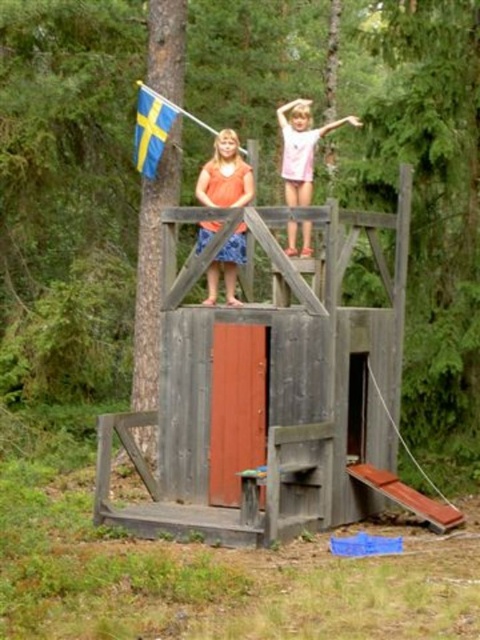
Question: Which of the following is the farthest from the observer?

Choices:
 (A) (151, 140)
 (B) (210, 237)

Answer: (A)

Question: Estimate the real-world distances between objects in this image. Which object is farther from the pink cotton shirt at upper center?

Choices:
 (A) blue fabric flag at upper left
 (B) wooden playhouse at center
 (C) orange fabric dress at center

Answer: (A)

Question: Is the position of wooden playhouse at center less distant than that of blue fabric flag at upper left?

Choices:
 (A) yes
 (B) no

Answer: (A)

Question: Can you confirm if orange fabric dress at center is smaller than pink cotton shirt at upper center?

Choices:
 (A) no
 (B) yes

Answer: (A)

Question: Observing the image, what is the correct spatial positioning of pink cotton shirt at upper center in reference to blue fabric flag at upper left?

Choices:
 (A) left
 (B) right

Answer: (B)

Question: Which of the following is the closest to the observer?

Choices:
 (A) wooden playhouse at center
 (B) orange fabric dress at center
 (C) pink cotton shirt at upper center
 (D) blue fabric flag at upper left

Answer: (A)